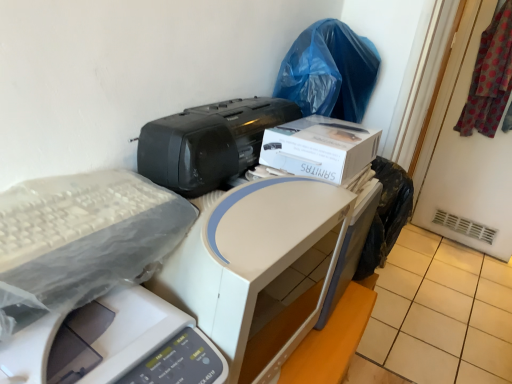
Question: Is white plastic printer at center, which is the 2th printer in top-to-bottom order, looking in the opposite direction of blue plastic bag at upper right?

Choices:
 (A) yes
 (B) no

Answer: (B)

Question: Considering the relative sizes of white plastic printer at center, which is the 2th printer in top-to-bottom order, and blue plastic bag at upper right in the image provided, is white plastic printer at center, which is the 2th printer in top-to-bottom order, bigger than blue plastic bag at upper right?

Choices:
 (A) yes
 (B) no

Answer: (A)

Question: Can you confirm if white plastic printer at center, which is the 2th printer in top-to-bottom order, is shorter than blue plastic bag at upper right?

Choices:
 (A) yes
 (B) no

Answer: (B)

Question: Does white plastic printer at center, acting as the 2th printer starting from the bottom, have a greater height compared to blue plastic bag at upper right?

Choices:
 (A) no
 (B) yes

Answer: (B)

Question: Is white plastic printer at center, which is the 2th printer in top-to-bottom order, at the right side of blue plastic bag at upper right?

Choices:
 (A) yes
 (B) no

Answer: (B)

Question: From a real-world perspective, is white plastic printer at center, acting as the 2th printer starting from the bottom, below blue plastic bag at upper right?

Choices:
 (A) no
 (B) yes

Answer: (B)

Question: Can you confirm if black plastic printer at center, arranged as the third printer when ordered from the bottom, is taller than white plastic printer at center, acting as the 2th printer starting from the bottom?

Choices:
 (A) no
 (B) yes

Answer: (A)

Question: Does black plastic printer at center, which is counted as the first printer, starting from the top, have a larger size compared to white plastic printer at center, which is the 2th printer in top-to-bottom order?

Choices:
 (A) yes
 (B) no

Answer: (B)

Question: Considering the relative sizes of black plastic printer at center, which is counted as the first printer, starting from the top, and white plastic printer at center, which is the 2th printer in top-to-bottom order, in the image provided, is black plastic printer at center, which is counted as the first printer, starting from the top, smaller than white plastic printer at center, which is the 2th printer in top-to-bottom order,?

Choices:
 (A) no
 (B) yes

Answer: (B)

Question: Can you confirm if black plastic printer at center, arranged as the third printer when ordered from the bottom, is positioned to the right of white plastic printer at center, acting as the 2th printer starting from the bottom?

Choices:
 (A) yes
 (B) no

Answer: (B)

Question: Considering the relative positions of black plastic printer at center, arranged as the third printer when ordered from the bottom, and white plastic printer at center, acting as the 2th printer starting from the bottom, in the image provided, is black plastic printer at center, arranged as the third printer when ordered from the bottom, to the left of white plastic printer at center, acting as the 2th printer starting from the bottom, from the viewer's perspective?

Choices:
 (A) no
 (B) yes

Answer: (B)

Question: From the image's perspective, would you say black plastic printer at center, arranged as the third printer when ordered from the bottom, is positioned over white plastic printer at center, which is the 2th printer in top-to-bottom order?

Choices:
 (A) no
 (B) yes

Answer: (B)

Question: Is the position of white cardboard box at upper center less distant than that of blue plastic bag at upper right?

Choices:
 (A) no
 (B) yes

Answer: (B)